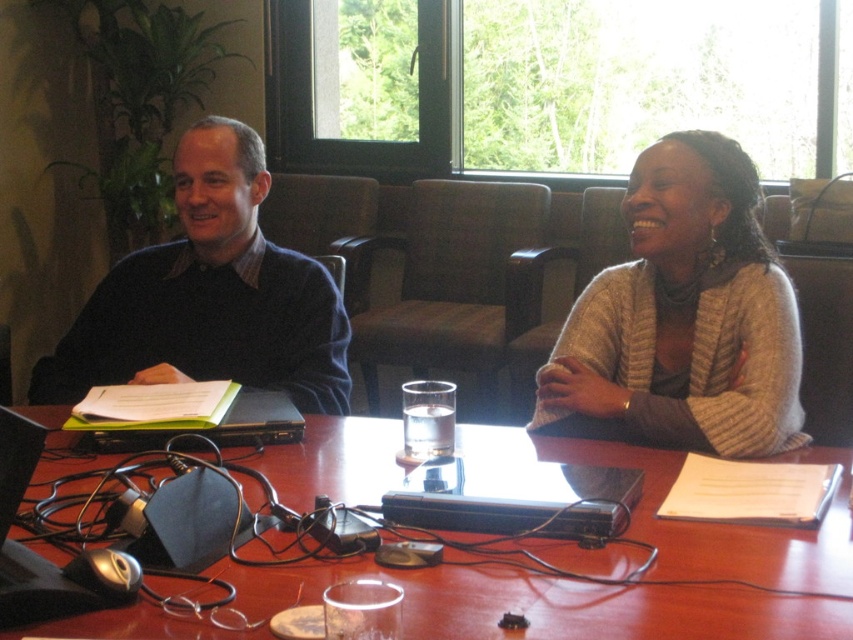
Question: Is matte black sweater at left below wooden table at center?

Choices:
 (A) no
 (B) yes

Answer: (A)

Question: Which of the following is the farthest from the observer?

Choices:
 (A) (630, 342)
 (B) (86, 598)
 (C) (227, 189)

Answer: (C)

Question: Does dark blue sweater at upper left have a greater width compared to black plastic laptop at lower left?

Choices:
 (A) yes
 (B) no

Answer: (A)

Question: Which object is closer to the camera taking this photo?

Choices:
 (A) knitted beige sweater at center
 (B) black plastic laptop at lower left

Answer: (B)

Question: Is knitted beige sweater at center to the left of black plastic laptop at lower left from the viewer's perspective?

Choices:
 (A) no
 (B) yes

Answer: (A)

Question: Which point is closer to the camera?

Choices:
 (A) (338, 486)
 (B) (573, 346)

Answer: (A)